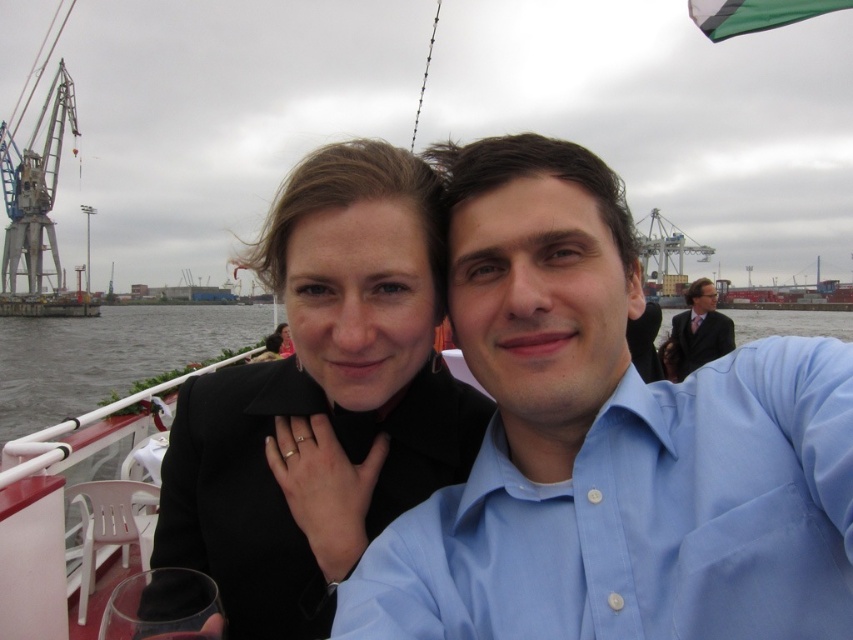
You are a photographer trying to capture a clear shot of the two people in the scene. The light blue cotton shirt at upper right and the dark suit at center are both in your frame. Since you want to ensure both subjects are in focus, which one should you adjust your camera focus on first to account for their height difference?

The light blue cotton shirt at upper right is taller than the dark suit at center. To ensure both are in focus, you should focus on the light blue cotton shirt at upper right first, as it is the taller subject, and then adjust the focus to include the shorter subject.